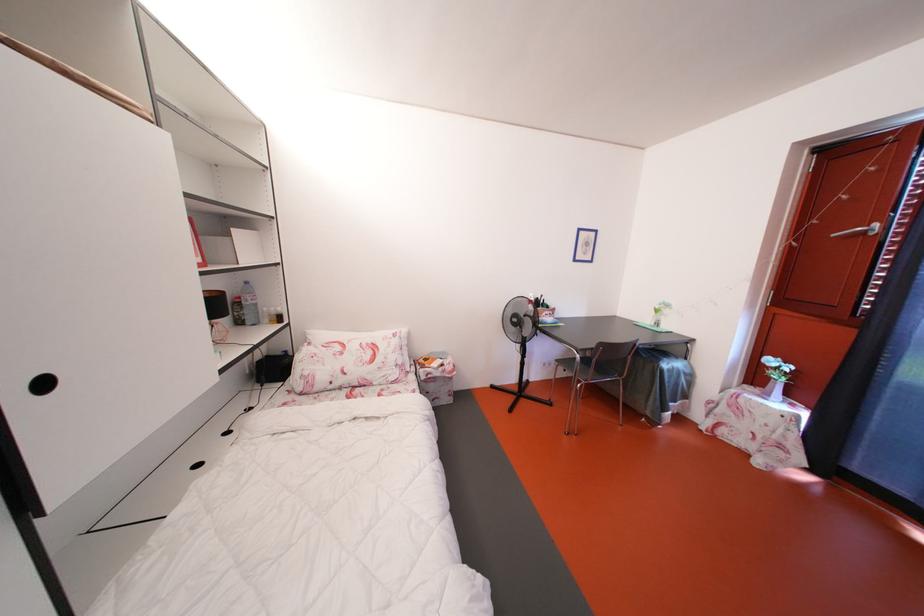
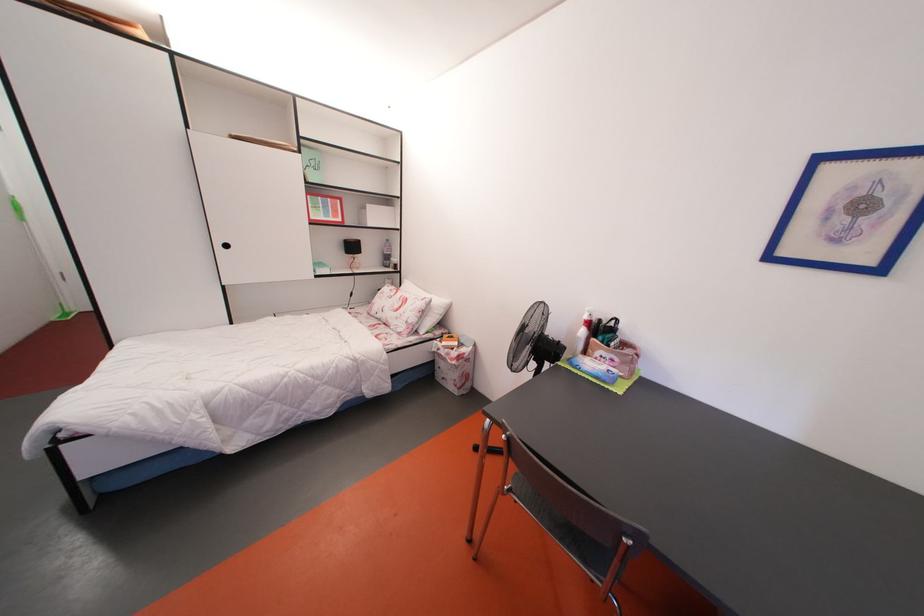
The point at (x=444, y=379) is marked in the first image. Where is the corresponding point in the second image?

(450, 360)